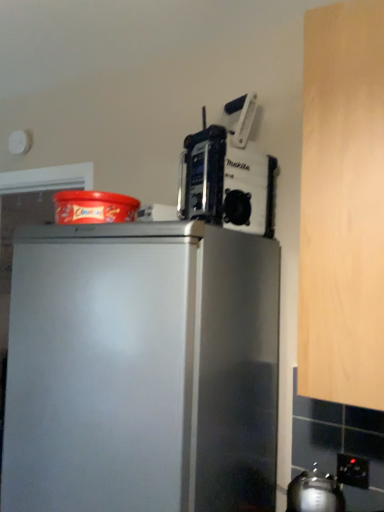
Question: Can you confirm if metallic silver kettle at lower right is positioned to the right of metallic silver power tool at upper right?

Choices:
 (A) no
 (B) yes

Answer: (B)

Question: Can you confirm if metallic silver kettle at lower right is wider than metallic silver power tool at upper right?

Choices:
 (A) no
 (B) yes

Answer: (A)

Question: Is metallic silver kettle at lower right taller than metallic silver power tool at upper right?

Choices:
 (A) yes
 (B) no

Answer: (B)

Question: Is metallic silver kettle at lower right smaller than metallic silver power tool at upper right?

Choices:
 (A) yes
 (B) no

Answer: (A)

Question: Would you consider metallic silver kettle at lower right to be distant from metallic silver power tool at upper right?

Choices:
 (A) yes
 (B) no

Answer: (B)

Question: Considering the relative sizes of metallic silver kettle at lower right and metallic silver power tool at upper right in the image provided, is metallic silver kettle at lower right bigger than metallic silver power tool at upper right?

Choices:
 (A) yes
 (B) no

Answer: (B)

Question: Could you tell me if metallic silver power tool at upper right is turned towards black plastic electric outlet at lower right?

Choices:
 (A) yes
 (B) no

Answer: (B)

Question: Considering the relative sizes of metallic silver power tool at upper right and black plastic electric outlet at lower right in the image provided, is metallic silver power tool at upper right shorter than black plastic electric outlet at lower right?

Choices:
 (A) yes
 (B) no

Answer: (B)

Question: Is metallic silver power tool at upper right oriented away from black plastic electric outlet at lower right?

Choices:
 (A) yes
 (B) no

Answer: (B)

Question: Is metallic silver power tool at upper right closer to camera compared to black plastic electric outlet at lower right?

Choices:
 (A) no
 (B) yes

Answer: (B)

Question: Can you confirm if metallic silver power tool at upper right is smaller than black plastic electric outlet at lower right?

Choices:
 (A) no
 (B) yes

Answer: (A)

Question: Are metallic silver power tool at upper right and black plastic electric outlet at lower right located far from each other?

Choices:
 (A) yes
 (B) no

Answer: (B)

Question: Is metallic silver kettle at lower right surrounding black plastic electric outlet at lower right?

Choices:
 (A) yes
 (B) no

Answer: (B)